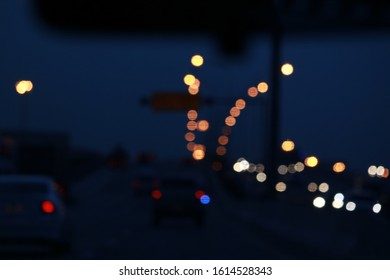
Locate an element on the screen. Image resolution: width=390 pixels, height=280 pixels. light is located at coordinates (349, 205).